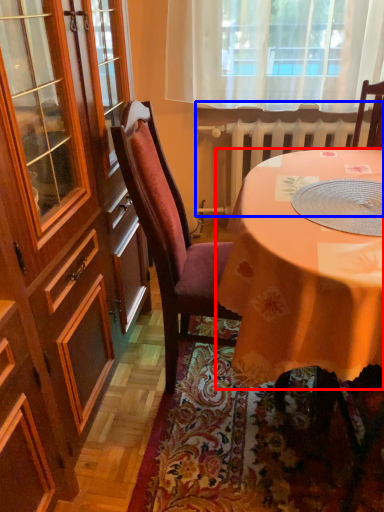
Question: Which object is further to the camera taking this photo, desk (highlighted by a red box) or radiator (highlighted by a blue box)?

Choices:
 (A) desk
 (B) radiator

Answer: (B)